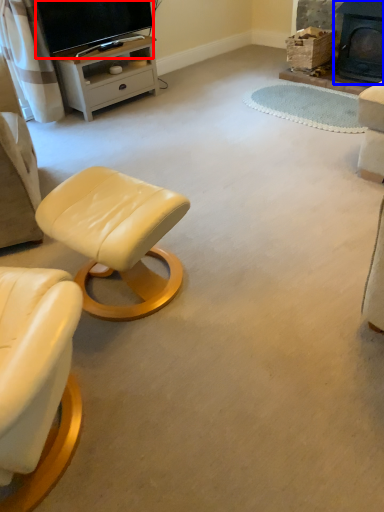
Question: Which of the following is the farthest to the observer, television (highlighted by a red box) or fireplace (highlighted by a blue box)?

Choices:
 (A) television
 (B) fireplace

Answer: (B)